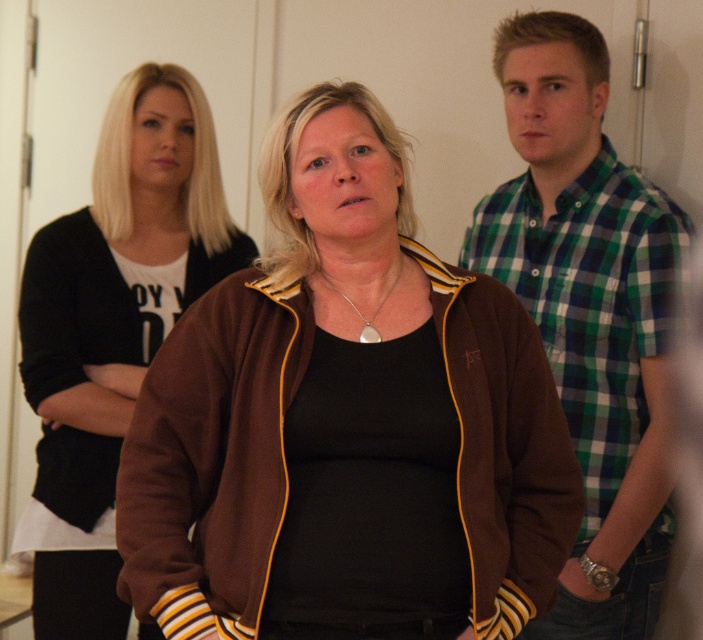
Question: Which object appears farthest from the camera in this image?

Choices:
 (A) brown fleece jacket at center
 (B) green plaid shirt at right
 (C) brown fabric jacket at center

Answer: (C)

Question: Is green plaid shirt at right smaller than brown fabric jacket at center?

Choices:
 (A) no
 (B) yes

Answer: (A)

Question: Among these points, which one is farthest from the camera?

Choices:
 (A) (77, 476)
 (B) (264, 301)
 (C) (624, 532)

Answer: (A)

Question: Can you confirm if brown fleece jacket at center is wider than brown fabric jacket at center?

Choices:
 (A) no
 (B) yes

Answer: (A)

Question: Which of the following is the closest to the observer?

Choices:
 (A) (243, 410)
 (B) (606, 154)
 (C) (84, 502)

Answer: (A)

Question: Can you confirm if green plaid shirt at right is wider than brown fabric jacket at center?

Choices:
 (A) yes
 (B) no

Answer: (B)